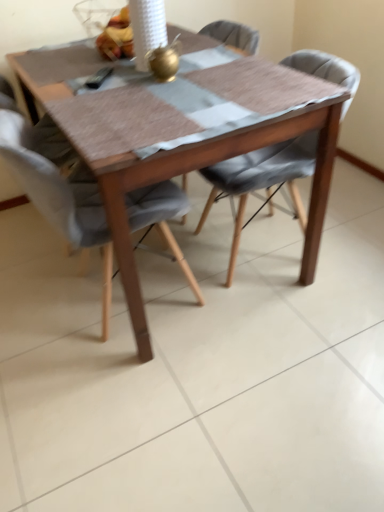
The image size is (384, 512). What do you see at coordinates (59, 199) in the screenshot?
I see `light gray fabric chair at center, which appears as the first chair when viewed from the left` at bounding box center [59, 199].

Image resolution: width=384 pixels, height=512 pixels. Identify the location of light gray fabric chair at center, which appears as the first chair when viewed from the left. (59, 199).

The height and width of the screenshot is (512, 384). Describe the element at coordinates (261, 179) in the screenshot. I see `textured gray cushioned chair at center, the second chair viewed from the left` at that location.

What do you see at coordinates (117, 37) in the screenshot? The height and width of the screenshot is (512, 384). I see `shiny plastic bag of fruits at upper center` at bounding box center [117, 37].

What is the approximate height of wooden table at center?

It is 73.17 centimeters.

Identify the location of light gray fabric chair at center, marked as the second chair in a right-to-left arrangement. tap(59, 199).

Are textured gray cushioned chair at center, the second chair viewed from the left, and shiny plastic bag of fruits at upper center far apart?

No, there isn't a large distance between textured gray cushioned chair at center, the second chair viewed from the left, and shiny plastic bag of fruits at upper center.

From the image's perspective, is textured gray cushioned chair at center, the second chair viewed from the left, under shiny plastic bag of fruits at upper center?

Yes.

From a real-world perspective, is textured gray cushioned chair at center, the second chair viewed from the left, above or below shiny plastic bag of fruits at upper center?

textured gray cushioned chair at center, the second chair viewed from the left, is situated lower than shiny plastic bag of fruits at upper center in the real world.

Measure the distance from textured gray cushioned chair at center, the 1th chair positioned from the right, to shiny plastic bag of fruits at upper center.

A distance of 25.20 inches exists between textured gray cushioned chair at center, the 1th chair positioned from the right, and shiny plastic bag of fruits at upper center.

From the image's perspective, which object appears higher, wooden table at center or light gray fabric chair at center, marked as the second chair in a right-to-left arrangement?

wooden table at center, from the image's perspective.

Is wooden table at center located outside light gray fabric chair at center, marked as the second chair in a right-to-left arrangement?

Absolutely, wooden table at center is external to light gray fabric chair at center, marked as the second chair in a right-to-left arrangement.

At what (x,y) coordinates should I click in order to perform the action: click on kitchen & dining room table on the right of the light gray fabric chair at center, marked as the second chair in a right-to-left arrangement. Please return your answer as a coordinate pair (x, y). This screenshot has height=512, width=384. Looking at the image, I should click on (179, 136).

In terms of height, does wooden table at center look taller or shorter compared to light gray fabric chair at center, which appears as the first chair when viewed from the left?

Clearly, wooden table at center is shorter compared to light gray fabric chair at center, which appears as the first chair when viewed from the left.

Is shiny plastic bag of fruits at upper center thinner than wooden table at center?

Indeed, shiny plastic bag of fruits at upper center has a lesser width compared to wooden table at center.

From the picture: Who is smaller, shiny plastic bag of fruits at upper center or wooden table at center?

shiny plastic bag of fruits at upper center is smaller.

From a real-world perspective, which object rests below the other?

wooden table at center is physically lower.

Which is more to the right, textured gray cushioned chair at center, the 1th chair positioned from the right, or wooden table at center?

From the viewer's perspective, textured gray cushioned chair at center, the 1th chair positioned from the right, appears more on the right side.

Which of these two, textured gray cushioned chair at center, the second chair viewed from the left, or wooden table at center, is bigger?

wooden table at center is bigger.

Which of these two, textured gray cushioned chair at center, the 1th chair positioned from the right, or wooden table at center, is wider?

wooden table at center is wider.

Is textured gray cushioned chair at center, the second chair viewed from the left, positioned far away from wooden table at center?

No, textured gray cushioned chair at center, the second chair viewed from the left, is not far away from wooden table at center.

Is shiny plastic bag of fruits at upper center far away from textured gray cushioned chair at center, the second chair viewed from the left?

shiny plastic bag of fruits at upper center is near textured gray cushioned chair at center, the second chair viewed from the left, not far away.

Considering the relative sizes of shiny plastic bag of fruits at upper center and textured gray cushioned chair at center, the 1th chair positioned from the right, in the image provided, is shiny plastic bag of fruits at upper center taller than textured gray cushioned chair at center, the 1th chair positioned from the right,?

Incorrect, the height of shiny plastic bag of fruits at upper center is not larger of that of textured gray cushioned chair at center, the 1th chair positioned from the right.

From a real-world perspective, is shiny plastic bag of fruits at upper center physically below textured gray cushioned chair at center, the second chair viewed from the left?

Incorrect, from a real-world perspective, shiny plastic bag of fruits at upper center is higher than textured gray cushioned chair at center, the second chair viewed from the left.

Based on the photo, from the image's perspective, which one is positioned higher, shiny plastic bag of fruits at upper center or textured gray cushioned chair at center, the second chair viewed from the left?

From the image's view, shiny plastic bag of fruits at upper center is above.

Would you say shiny plastic bag of fruits at upper center is outside light gray fabric chair at center, which appears as the first chair when viewed from the left?

Yes, shiny plastic bag of fruits at upper center is not within light gray fabric chair at center, which appears as the first chair when viewed from the left.

Between shiny plastic bag of fruits at upper center and light gray fabric chair at center, which appears as the first chair when viewed from the left, which one has more height?

With more height is light gray fabric chair at center, which appears as the first chair when viewed from the left.

The image size is (384, 512). I want to click on the 2nd chair below when counting from the shiny plastic bag of fruits at upper center (from the image's perspective), so click(x=59, y=199).

Looking at this image, could you measure the distance between shiny plastic bag of fruits at upper center and light gray fabric chair at center, marked as the second chair in a right-to-left arrangement?

shiny plastic bag of fruits at upper center and light gray fabric chair at center, marked as the second chair in a right-to-left arrangement, are 23.87 inches apart from each other.

Is textured gray cushioned chair at center, the 1th chair positioned from the right, touching light gray fabric chair at center, marked as the second chair in a right-to-left arrangement?

No, textured gray cushioned chair at center, the 1th chair positioned from the right, is not touching light gray fabric chair at center, marked as the second chair in a right-to-left arrangement.

Is textured gray cushioned chair at center, the second chair viewed from the left, taller than light gray fabric chair at center, which appears as the first chair when viewed from the left?

Incorrect, the height of textured gray cushioned chair at center, the second chair viewed from the left, is not larger of that of light gray fabric chair at center, which appears as the first chair when viewed from the left.

Where is `chair below the textured gray cushioned chair at center, the second chair viewed from the left (from the image's perspective)`? chair below the textured gray cushioned chair at center, the second chair viewed from the left (from the image's perspective) is located at coordinates (59, 199).

From the image's perspective, is textured gray cushioned chair at center, the second chair viewed from the left, located above or below light gray fabric chair at center, which appears as the first chair when viewed from the left?

Based on their image positions, textured gray cushioned chair at center, the second chair viewed from the left, is located above light gray fabric chair at center, which appears as the first chair when viewed from the left.

The height and width of the screenshot is (512, 384). What are the coordinates of `food that is behind the textured gray cushioned chair at center, the 1th chair positioned from the right` in the screenshot? It's located at (117, 37).

Where is `the 2nd chair below the wooden table at center (from the image's perspective)`? The image size is (384, 512). the 2nd chair below the wooden table at center (from the image's perspective) is located at coordinates (59, 199).

Looking at the image, which one is located further to wooden table at center, light gray fabric chair at center, which appears as the first chair when viewed from the left, or textured gray cushioned chair at center, the second chair viewed from the left?

Among the two, textured gray cushioned chair at center, the second chair viewed from the left, is located further to wooden table at center.

Considering their positions, is wooden table at center positioned further to textured gray cushioned chair at center, the 1th chair positioned from the right, than light gray fabric chair at center, which appears as the first chair when viewed from the left?

Based on the image, light gray fabric chair at center, which appears as the first chair when viewed from the left, appears to be further to textured gray cushioned chair at center, the 1th chair positioned from the right.

Considering their positions, is shiny plastic bag of fruits at upper center positioned further to textured gray cushioned chair at center, the second chair viewed from the left, than wooden table at center?

shiny plastic bag of fruits at upper center is further to textured gray cushioned chair at center, the second chair viewed from the left.

Looking at this image, looking at the image, which one is located further to shiny plastic bag of fruits at upper center, textured gray cushioned chair at center, the second chair viewed from the left, or light gray fabric chair at center, which appears as the first chair when viewed from the left?

Among the two, textured gray cushioned chair at center, the second chair viewed from the left, is located further to shiny plastic bag of fruits at upper center.

From the image, which object appears to be farther from shiny plastic bag of fruits at upper center, light gray fabric chair at center, marked as the second chair in a right-to-left arrangement, or textured gray cushioned chair at center, the second chair viewed from the left?

textured gray cushioned chair at center, the second chair viewed from the left.

Estimate the real-world distances between objects in this image. Which object is closer to wooden table at center, shiny plastic bag of fruits at upper center or textured gray cushioned chair at center, the second chair viewed from the left?

textured gray cushioned chair at center, the second chair viewed from the left, is closer to wooden table at center.

Looking at the image, which one is located closer to light gray fabric chair at center, marked as the second chair in a right-to-left arrangement, wooden table at center or textured gray cushioned chair at center, the second chair viewed from the left?

wooden table at center.

Estimate the real-world distances between objects in this image. Which object is closer to shiny plastic bag of fruits at upper center, wooden table at center or light gray fabric chair at center, which appears as the first chair when viewed from the left?

Among the two, wooden table at center is located nearer to shiny plastic bag of fruits at upper center.

Locate an element on the screen. kitchen & dining room table that lies between shiny plastic bag of fruits at upper center and light gray fabric chair at center, which appears as the first chair when viewed from the left, from top to bottom is located at coordinates (179, 136).

Locate an element on the screen. The width and height of the screenshot is (384, 512). kitchen & dining room table between shiny plastic bag of fruits at upper center and textured gray cushioned chair at center, the second chair viewed from the left, in the horizontal direction is located at coordinates (179, 136).

Find the location of a particular element. The height and width of the screenshot is (512, 384). kitchen & dining room table situated between light gray fabric chair at center, marked as the second chair in a right-to-left arrangement, and textured gray cushioned chair at center, the 1th chair positioned from the right, from left to right is located at coordinates (179, 136).

The height and width of the screenshot is (512, 384). I want to click on chair between shiny plastic bag of fruits at upper center and light gray fabric chair at center, marked as the second chair in a right-to-left arrangement, in the up-down direction, so click(261, 179).